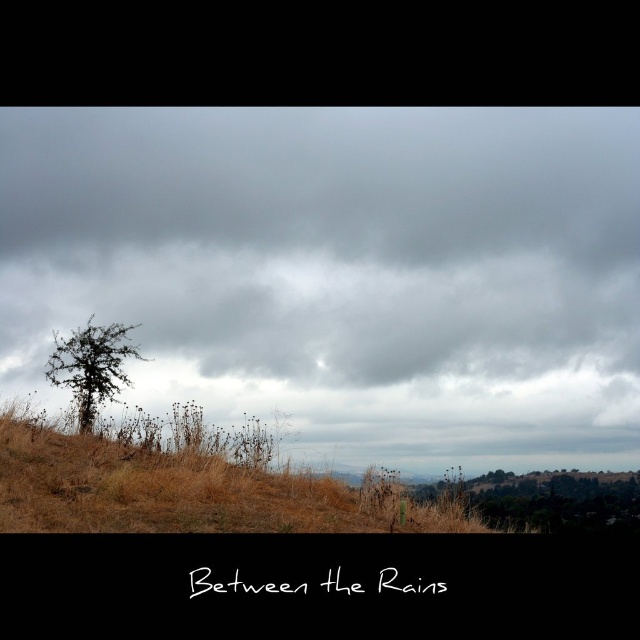
Question: Can you confirm if gray cloudy sky at upper center is positioned below brown textured tree at center?

Choices:
 (A) no
 (B) yes

Answer: (A)

Question: Does gray cloudy sky at upper center appear on the left side of brown textured tree at center?

Choices:
 (A) no
 (B) yes

Answer: (A)

Question: Can you confirm if gray cloudy sky at upper center is positioned above brown grassy tree at lower right?

Choices:
 (A) yes
 (B) no

Answer: (A)

Question: Among these objects, which one is nearest to the camera?

Choices:
 (A) gray cloudy sky at upper center
 (B) brown grassy hillside at lower center

Answer: (B)

Question: Estimate the real-world distances between objects in this image. Which object is farther from the brown grassy tree at lower right?

Choices:
 (A) brown grassy hillside at lower center
 (B) brown textured tree at center
 (C) gray cloudy sky at upper center

Answer: (A)

Question: Which object is the farthest from the brown grassy tree at lower right?

Choices:
 (A) brown grassy hillside at lower center
 (B) brown textured tree at center
 (C) gray cloudy sky at upper center

Answer: (A)